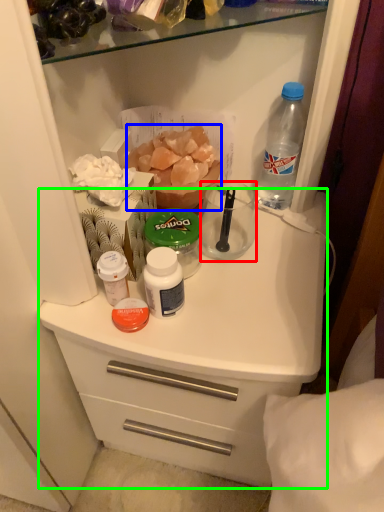
Question: Which object is positioned closest to coffee cup (highlighted by a red box)? Select from food (highlighted by a blue box) and counter (highlighted by a green box).

Choices:
 (A) food
 (B) counter

Answer: (A)